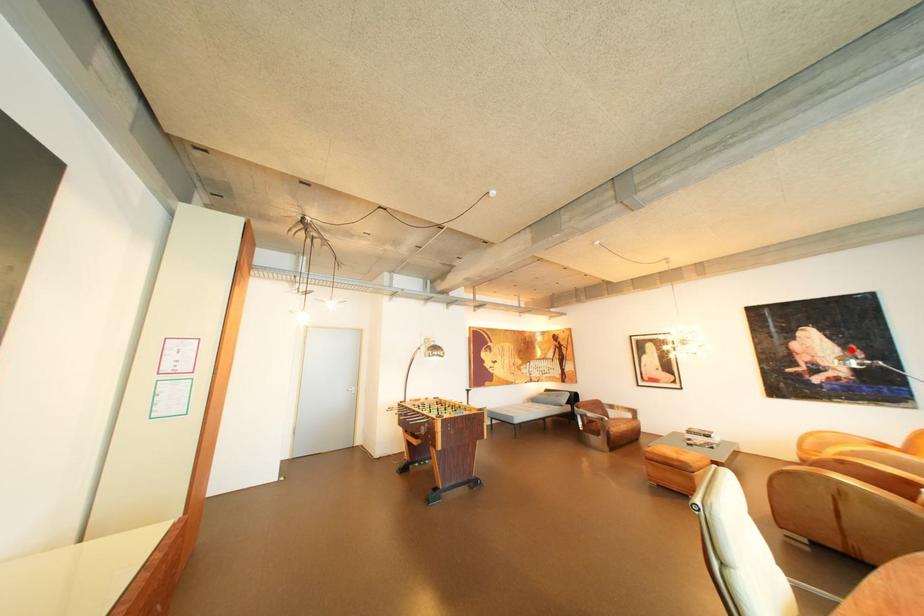
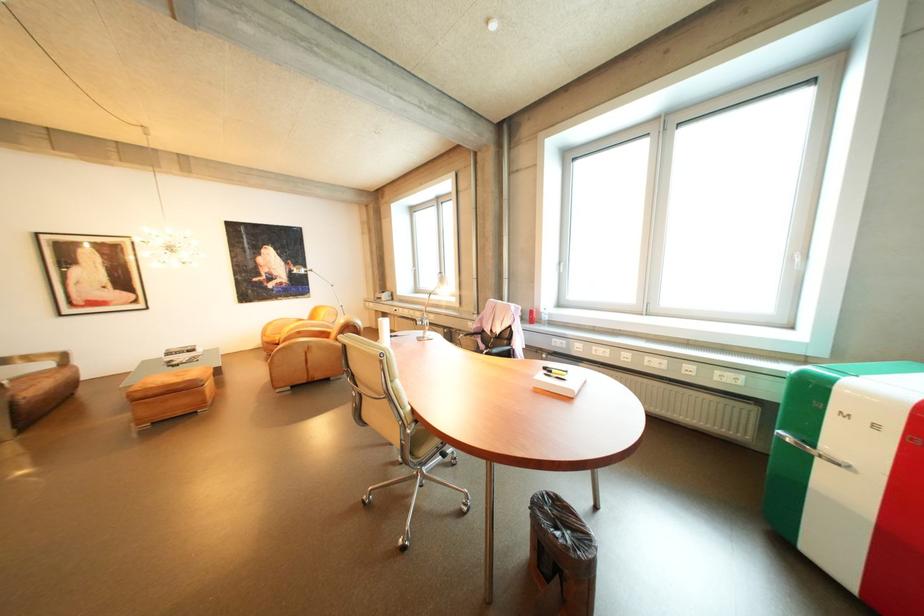
In the second image, find the point that corresponds to the highlighted location in the first image.

(296, 264)